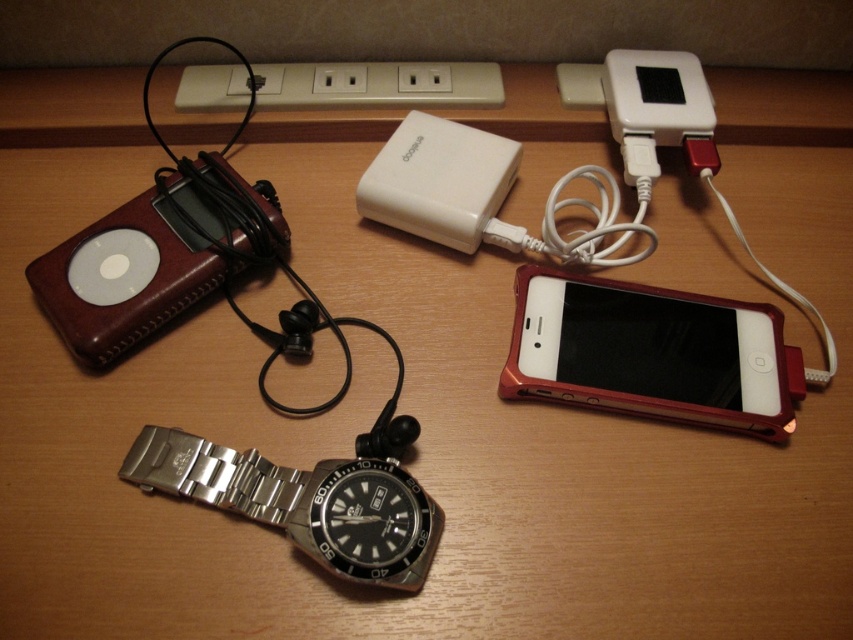
Can you confirm if metallic red smartphone at lower right is smaller than leather ipod at left?

Indeed, metallic red smartphone at lower right has a smaller size compared to leather ipod at left.

This screenshot has height=640, width=853. Find the location of `metallic red smartphone at lower right`. metallic red smartphone at lower right is located at coordinates (648, 353).

Where is `metallic red smartphone at lower right`? The height and width of the screenshot is (640, 853). metallic red smartphone at lower right is located at coordinates (648, 353).

Is metallic red smartphone at lower right bigger than white matte power bank at center?

Yes.

Is metallic red smartphone at lower right positioned in front of white matte power bank at center?

Yes, it is in front of white matte power bank at center.

Where is `metallic red smartphone at lower right`? This screenshot has height=640, width=853. metallic red smartphone at lower right is located at coordinates (648, 353).

Image resolution: width=853 pixels, height=640 pixels. I want to click on metallic red smartphone at lower right, so (648, 353).

Between white plastic plug at upper center and white plastic ipod at upper right, which one has less height?

Standing shorter between the two is white plastic plug at upper center.

Is white plastic plug at upper center bigger than white plastic ipod at upper right?

No, white plastic plug at upper center is not bigger than white plastic ipod at upper right.

What are the coordinates of `white plastic plug at upper center` in the screenshot? It's located at (378, 84).